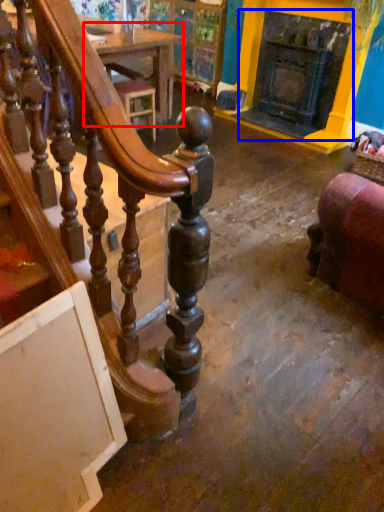
Question: Which object is closer to the camera taking this photo, table (highlighted by a red box) or fireplace (highlighted by a blue box)?

Choices:
 (A) table
 (B) fireplace

Answer: (B)